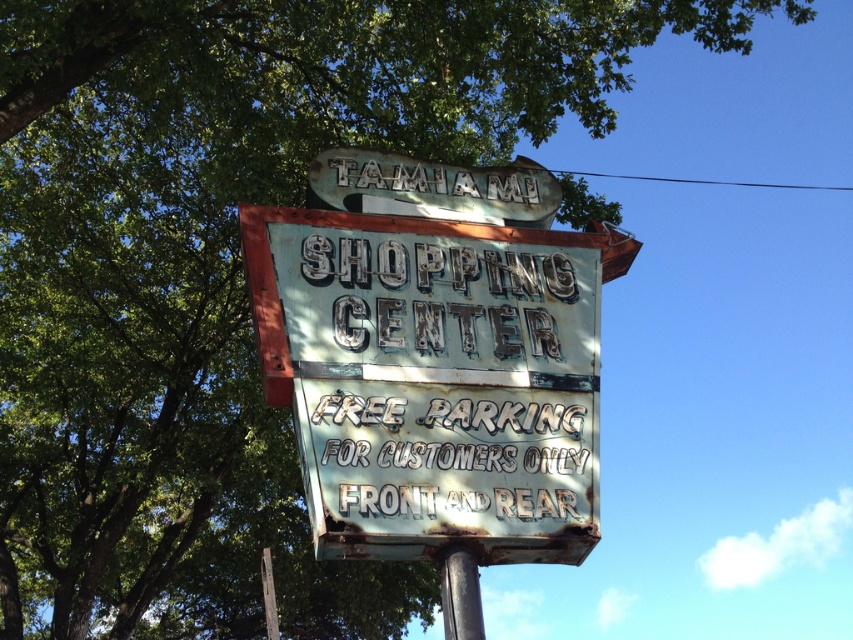
In the scene shown: You are a delivery driver who needs to unload a package that requires 2 meters of clearance height. You arrive at Tamiami Shopping Center and see the rusty metal sign at center and the rusty metal pole at lower center. Based on their heights, can you determine if the clearance is sufficient?

The rusty metal sign at center is taller than the rusty metal pole at lower center, but without knowing their exact heights, it is impossible to determine if the 2 meters clearance is sufficient.

You are standing in front of the Tamiami Shopping Center. You see a rusty metal sign at center and a rusty metal pole at lower center. Which object is positioned to the left of the other?

The rusty metal sign at center is to the left of the rusty metal pole at lower center.

You are standing in front of the Tamiami Shopping Center sign. There are two points marked on the sign at coordinates point (593, 310) and point (451, 616). Which point is closer to you?

Point (451, 616) is closer to you because it is less further to the camera than point (593, 310).